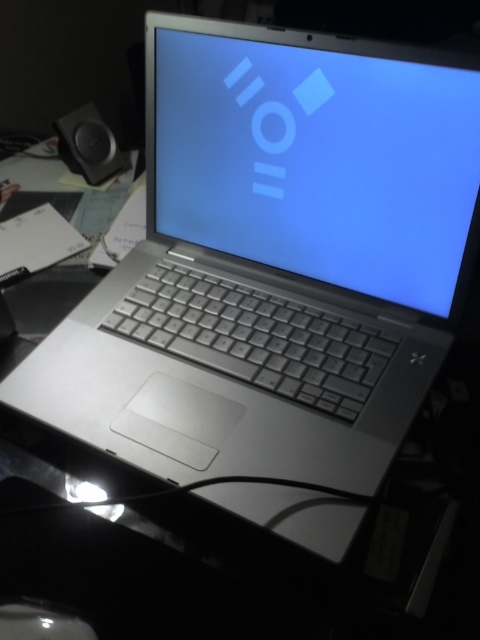
Does matte plastic screen at center have a larger size compared to black matte speaker at upper left?

Indeed, matte plastic screen at center has a larger size compared to black matte speaker at upper left.

Between matte plastic screen at center and black matte speaker at upper left, which one appears on the left side from the viewer's perspective?

Positioned to the left is black matte speaker at upper left.

Which is in front, point (460, 198) or point (84, 122)?

Point (460, 198) is in front.

Locate an element on the screen. The image size is (480, 640). matte plastic screen at center is located at coordinates (317, 156).